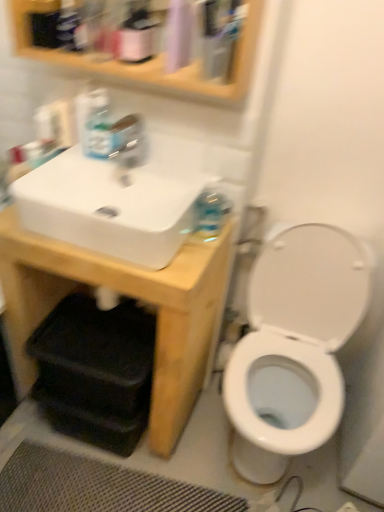
Question: From their relative heights in the image, would you say white glossy sink at upper left is taller or shorter than clear plastic mouthwash at upper center?

Choices:
 (A) tall
 (B) short

Answer: (B)

Question: Is white glossy sink at upper left in front of or behind clear plastic mouthwash at upper center in the image?

Choices:
 (A) front
 (B) behind

Answer: (B)

Question: Which of these objects is positioned closest to the translucent plastic soap dispenser at upper left?

Choices:
 (A) matte pink spray bottle at upper center
 (B) clear plastic mouthwash at upper center
 (C) white glossy sink at upper left
 (D) black textured bath mat at lower center
 (E) white matte sink at upper left

Answer: (C)

Question: Estimate the real-world distances between objects in this image. Which object is farther from the black textured bath mat at lower center?

Choices:
 (A) clear plastic mouthwash at upper center
 (B) white glossy toilet at right
 (C) wooden medicine cabinet at upper center
 (D) matte pink spray bottle at upper center
 (E) white glossy sink at upper left

Answer: (A)